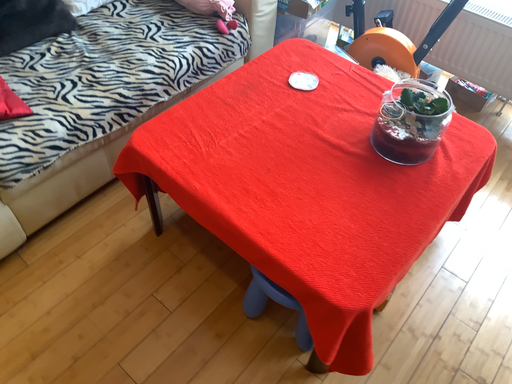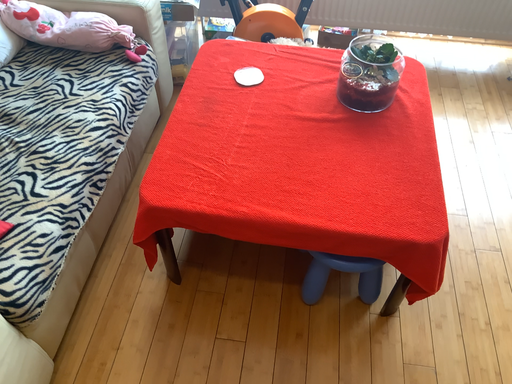
Question: How did the camera likely rotate when shooting the video?

Choices:
 (A) rotated right
 (B) rotated left

Answer: (A)